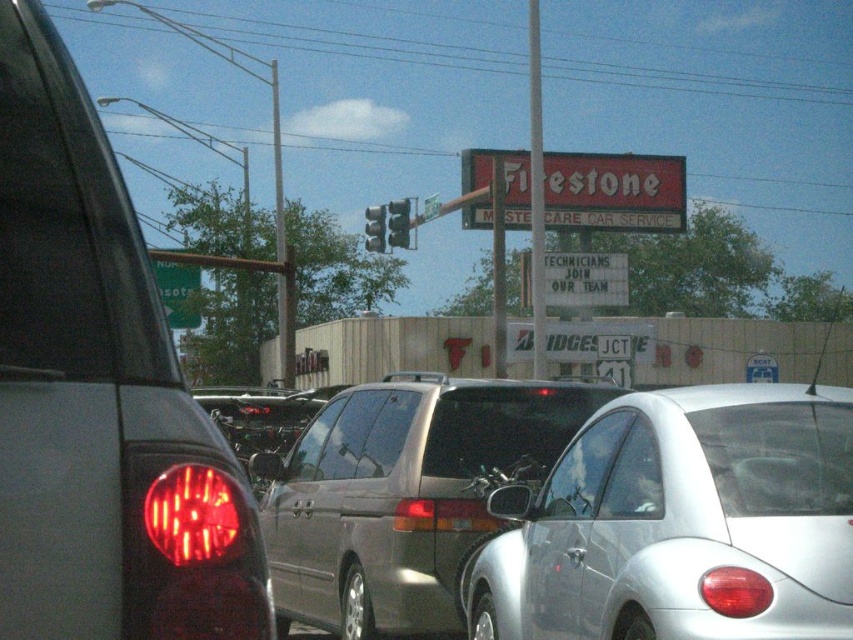
Question: Which point appears closest to the camera in this image?

Choices:
 (A) (402, 204)
 (B) (714, 451)
 (C) (439, 456)

Answer: (B)

Question: Is silver metallic car at center bigger than metallic traffic light at center?

Choices:
 (A) yes
 (B) no

Answer: (B)

Question: Among these points, which one is farthest from the camera?

Choices:
 (A) (457, 529)
 (B) (576, 417)
 (C) (374, 237)

Answer: (C)

Question: Does metallic traffic light at center appear under black plastic license plate at center?

Choices:
 (A) no
 (B) yes

Answer: (A)

Question: Observing the image, what is the correct spatial positioning of matte black car at left in reference to metallic silver traffic light at center?

Choices:
 (A) below
 (B) above

Answer: (A)

Question: Which point is closer to the camera taking this photo?

Choices:
 (A) (798, 561)
 (B) (291, 456)
 (C) (445, 522)
 (D) (65, 225)

Answer: (D)